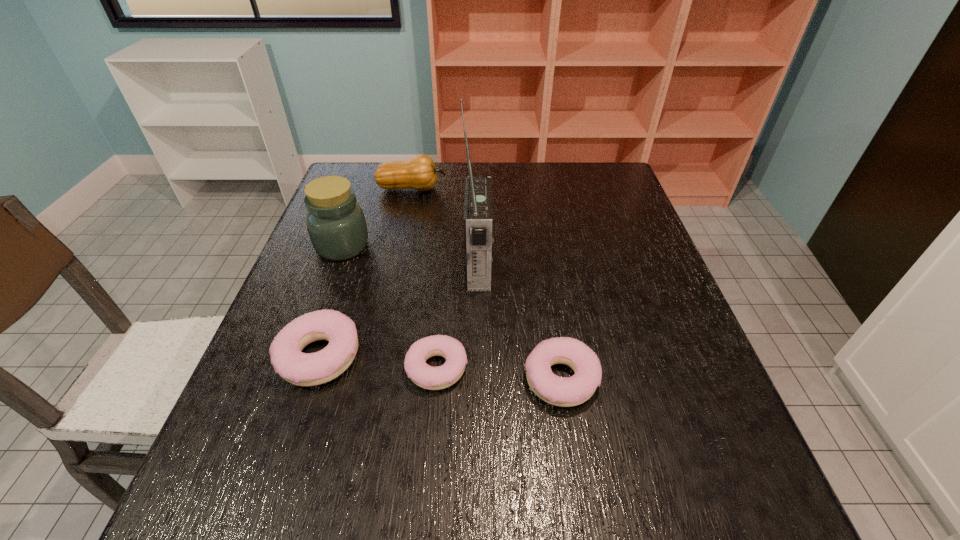
The image size is (960, 540). Identify the location of object that is positioned at the far left corner. (419, 172).

In the image, there is a desktop. Where is `vacant space at the far edge`? vacant space at the far edge is located at coordinates (522, 176).

The width and height of the screenshot is (960, 540). I want to click on free spot at the near edge of the desktop, so click(x=497, y=438).

At what (x,y) coordinates should I click in order to perform the action: click on vacant region at the left edge. Please return your answer as a coordinate pair (x, y). Looking at the image, I should click on (354, 281).

Find the location of `blank space at the right edge of the desktop`. blank space at the right edge of the desktop is located at coordinates (679, 390).

Where is `empty location between the leftmost doughnut and the radio receiver`? The width and height of the screenshot is (960, 540). empty location between the leftmost doughnut and the radio receiver is located at coordinates (398, 312).

At what (x,y) coordinates should I click in order to perform the action: click on vacant region between the leftmost doughnut and the gourd. Please return your answer as a coordinate pair (x, y). This screenshot has height=540, width=960. Looking at the image, I should click on (366, 273).

This screenshot has width=960, height=540. What are the coordinates of `vacant area that lies between the tallest object and the shortest doughnut` in the screenshot? It's located at (458, 317).

You are a GUI agent. You are given a task and a screenshot of the screen. Output one action in this format:
    pyautogui.click(x=<x>, y=<y>)
    Task: Click on the free space between the second shortest object and the jar
    
    Given the screenshot: What is the action you would take?
    pyautogui.click(x=452, y=313)

The height and width of the screenshot is (540, 960). I want to click on vacant space in between the radio receiver and the leftmost doughnut, so click(x=398, y=312).